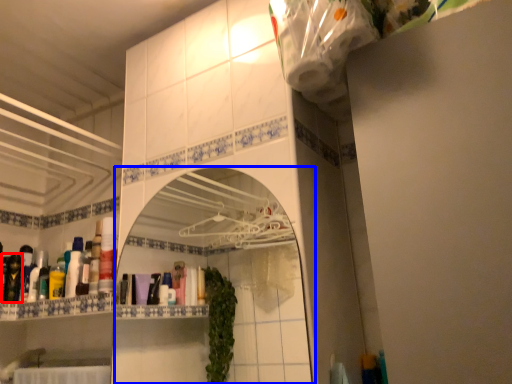
Question: Which object is closer to the camera taking this photo, toiletry (highlighted by a red box) or mirror (highlighted by a blue box)?

Choices:
 (A) toiletry
 (B) mirror

Answer: (B)